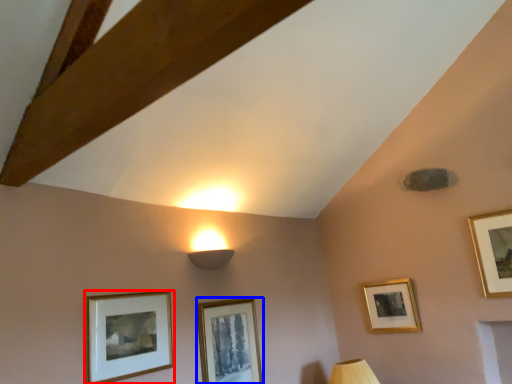
Question: Which object is closer to the camera taking this photo, picture frame (highlighted by a red box) or picture frame (highlighted by a blue box)?

Choices:
 (A) picture frame
 (B) picture frame

Answer: (A)